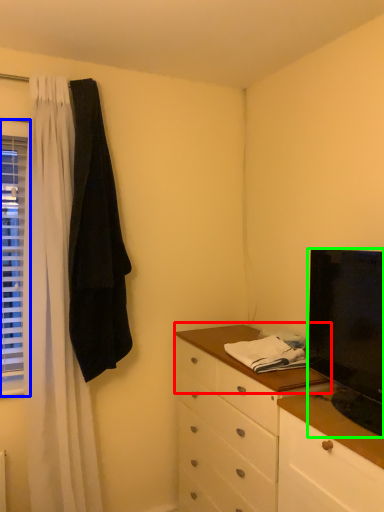
Question: Which object is the closest to the counter top (highlighted by a red box)? Choose among these: window (highlighted by a blue box) or television (highlighted by a green box).

Choices:
 (A) window
 (B) television

Answer: (B)